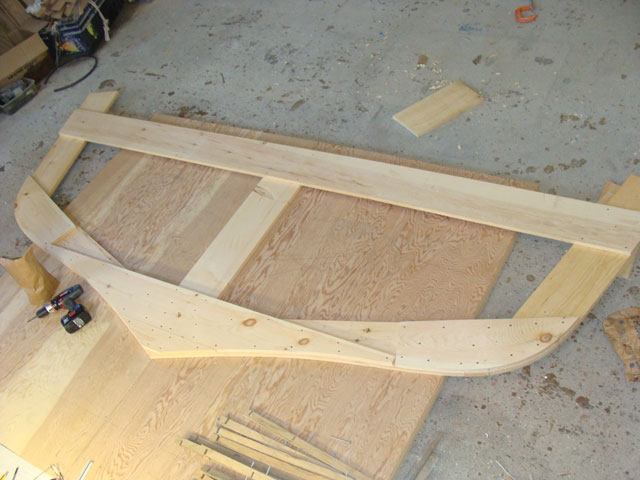
The width and height of the screenshot is (640, 480). In order to click on wood structure in this screenshot , I will do `click(200, 299)`.